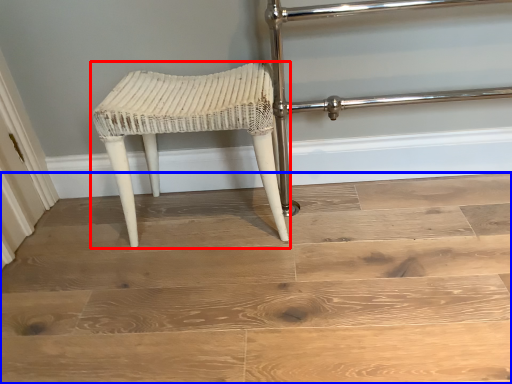
Question: Which object appears farthest to the camera in this image, stool (highlighted by a red box) or stairwell (highlighted by a blue box)?

Choices:
 (A) stool
 (B) stairwell

Answer: (A)